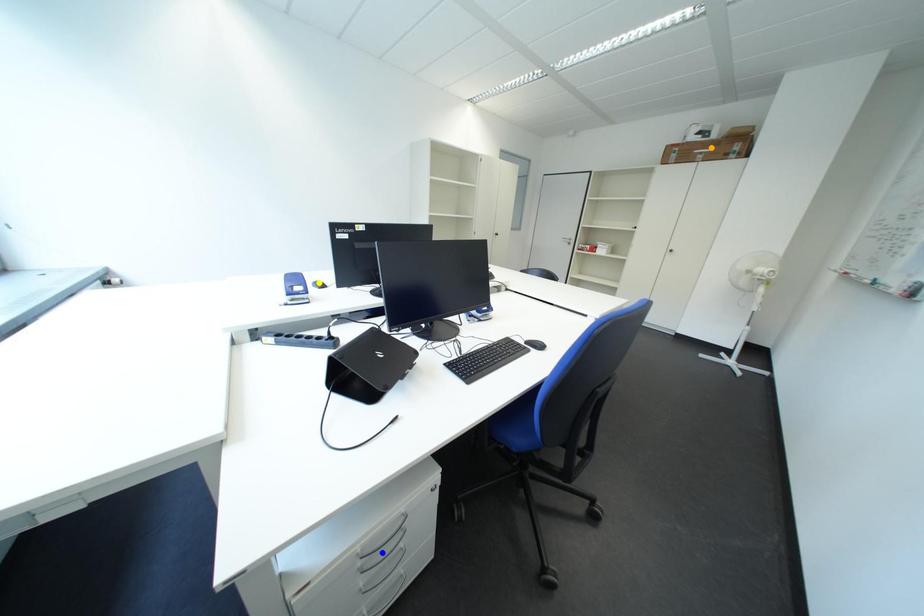
Order these from nearest to farthest:
yellow point | blue point | orange point

blue point, yellow point, orange point